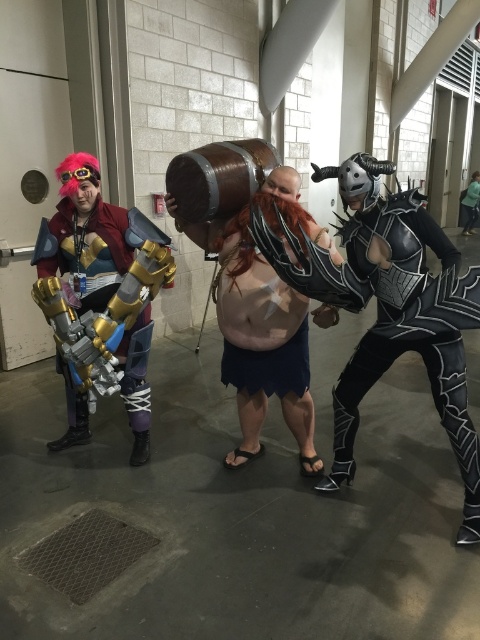
Consider the image. What is located at the coordinates point (387, 308)?

The coordinates point (387, 308) is where the black leather armor at right is located.

You are standing at the entrance of the convention hall and see the brushed metal armor at left. Can you estimate its location in the image using coordinates?

The brushed metal armor at left is located at coordinates point (101,300).